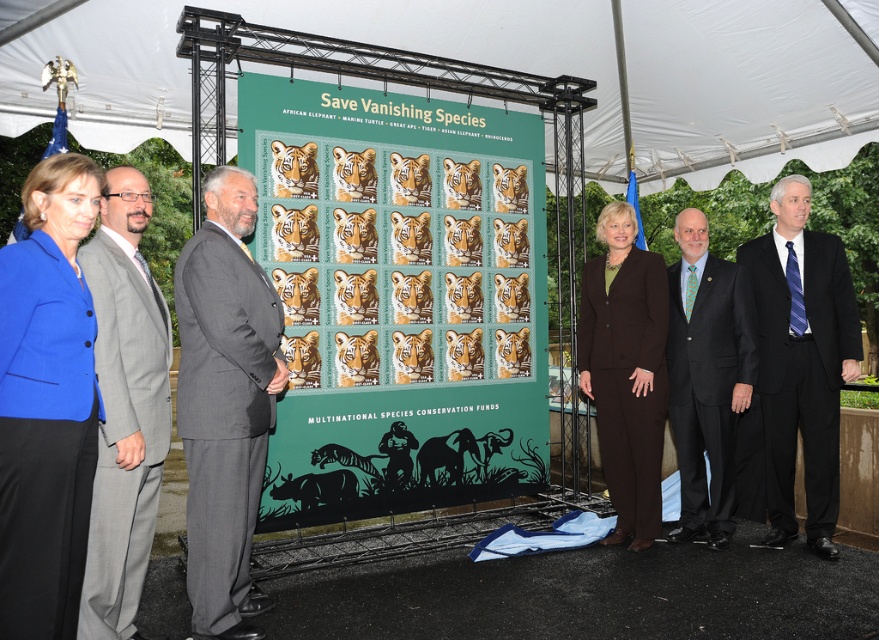
Question: Is white fabric canopy at upper center wider than dark gray suit at center?

Choices:
 (A) yes
 (B) no

Answer: (A)

Question: Does blue fabric jacket at left have a lesser width compared to black silk suit at center?

Choices:
 (A) no
 (B) yes

Answer: (B)

Question: Considering the real-world distances, which object is farthest from the dark gray suit at center?

Choices:
 (A) black silk suit at center
 (B) white fabric canopy at upper center

Answer: (B)

Question: Estimate the real-world distances between objects in this image. Which object is closer to the green matte poster at center?

Choices:
 (A) gray wool suit at center
 (B) brown woolen suit at center

Answer: (B)

Question: Which of the following is the farthest from the observer?

Choices:
 (A) dark gray suit at center
 (B) white fabric canopy at upper center
 (C) gray suit at left
 (D) green matte poster at center

Answer: (B)

Question: Is green matte poster at center further to camera compared to blue fabric jacket at left?

Choices:
 (A) yes
 (B) no

Answer: (A)